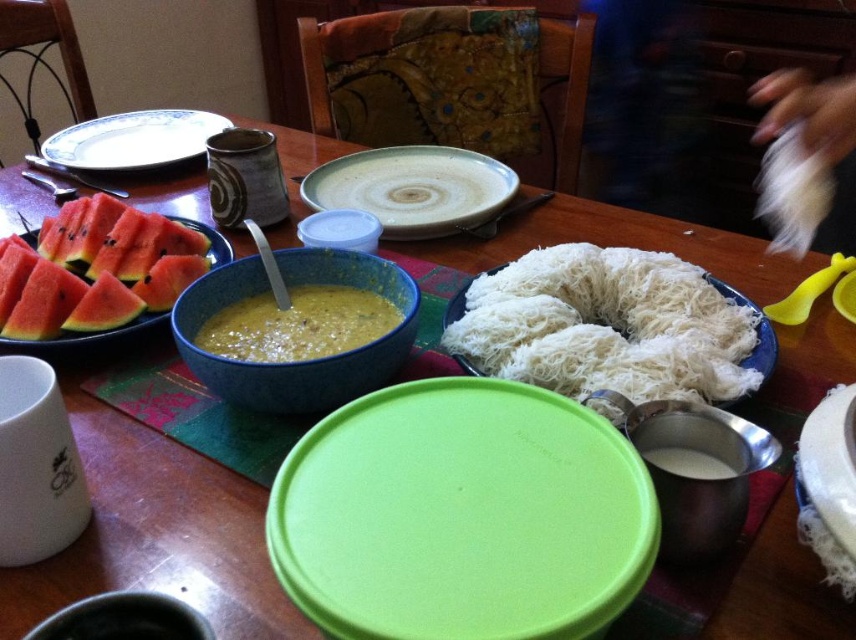
Between point (367, 392) and point (834, 392), which one is positioned behind?

Positioned behind is point (367, 392).

Can you confirm if blue speckled bowl at center is thinner than white matte plate at lower right?

No.

Who is more distant from viewer, (241,260) or (825,499)?

The point (241,260) is behind.

The height and width of the screenshot is (640, 856). In order to click on blue speckled bowl at center in this screenshot , I will do `click(302, 360)`.

Does white ceramic plate at upper left have a smaller size compared to white shredded food at center?

Actually, white ceramic plate at upper left might be larger than white shredded food at center.

Does point (51, 160) come behind point (753, 368)?

Yes.

Where is `white ceramic plate at upper left`? The width and height of the screenshot is (856, 640). white ceramic plate at upper left is located at coordinates (134, 140).

Where is `green plastic lid at center`? This screenshot has height=640, width=856. green plastic lid at center is located at coordinates (461, 515).

Which is behind, point (278, 492) or point (24, 236)?

Positioned behind is point (24, 236).

The image size is (856, 640). What do you see at coordinates (461, 515) in the screenshot? I see `green plastic lid at center` at bounding box center [461, 515].

Identify the location of green plastic lid at center. The height and width of the screenshot is (640, 856). (461, 515).